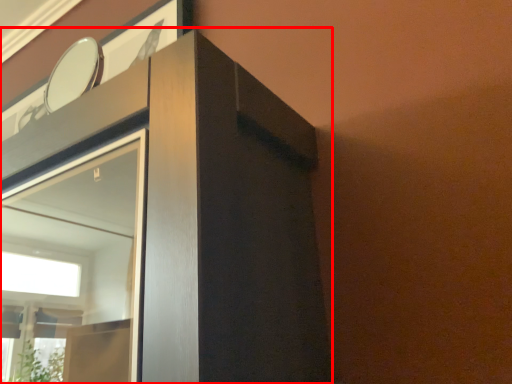
Question: From the image's perspective, where is dresser (annotated by the red box) located in relation to mirror in the image?

Choices:
 (A) above
 (B) below

Answer: (B)